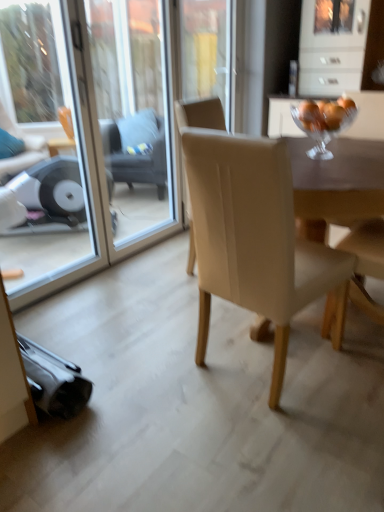
Question: From the image's perspective, does matte beige armchair at right appear lower than beige fabric chair at center?

Choices:
 (A) no
 (B) yes

Answer: (A)

Question: Is matte beige armchair at right positioned behind beige fabric chair at center?

Choices:
 (A) no
 (B) yes

Answer: (B)

Question: Is matte beige armchair at right to the left of beige fabric chair at center from the viewer's perspective?

Choices:
 (A) yes
 (B) no

Answer: (B)

Question: From a real-world perspective, does matte beige armchair at right stand above beige fabric chair at center?

Choices:
 (A) yes
 (B) no

Answer: (A)

Question: Can you confirm if matte beige armchair at right is positioned to the right of beige fabric chair at center?

Choices:
 (A) no
 (B) yes

Answer: (B)

Question: Is point (29, 134) positioned closer to the camera than point (324, 153)?

Choices:
 (A) closer
 (B) farther

Answer: (B)

Question: From the image's perspective, is transparent glass screen door at left, marked as the second screen door in a right-to-left arrangement, above or below clear glass bowl at upper right?

Choices:
 (A) below
 (B) above

Answer: (A)

Question: Considering the positions of transparent glass screen door at left, marked as the second screen door in a right-to-left arrangement, and clear glass bowl at upper right in the image, is transparent glass screen door at left, marked as the second screen door in a right-to-left arrangement, bigger or smaller than clear glass bowl at upper right?

Choices:
 (A) big
 (B) small

Answer: (A)

Question: From a real-world perspective, is transparent glass screen door at left, which is counted as the 1th screen door, starting from the left, positioned above or below clear glass bowl at upper right?

Choices:
 (A) below
 (B) above

Answer: (A)

Question: Is clear glass bowl at upper right bigger or smaller than transparent glass screen door at left, marked as the second screen door in a right-to-left arrangement?

Choices:
 (A) small
 (B) big

Answer: (A)

Question: Is point (337, 120) closer or farther from the camera than point (69, 105)?

Choices:
 (A) closer
 (B) farther

Answer: (A)

Question: In terms of width, does clear glass bowl at upper right look wider or thinner when compared to transparent glass screen door at left, which is counted as the 1th screen door, starting from the left?

Choices:
 (A) thin
 (B) wide

Answer: (B)

Question: Considering their positions, is clear glass bowl at upper right located in front of or behind transparent glass screen door at left, marked as the second screen door in a right-to-left arrangement?

Choices:
 (A) behind
 (B) front

Answer: (A)

Question: Choose the correct answer: Is transparent glass screen door at upper center, the 1th screen door when ordered from right to left, inside dark gray fabric swivel chair at center or outside it?

Choices:
 (A) inside
 (B) outside

Answer: (B)

Question: Considering the positions of transparent glass screen door at upper center, which appears as the 2th screen door when viewed from the left, and dark gray fabric swivel chair at center in the image, is transparent glass screen door at upper center, which appears as the 2th screen door when viewed from the left, taller or shorter than dark gray fabric swivel chair at center?

Choices:
 (A) short
 (B) tall

Answer: (B)